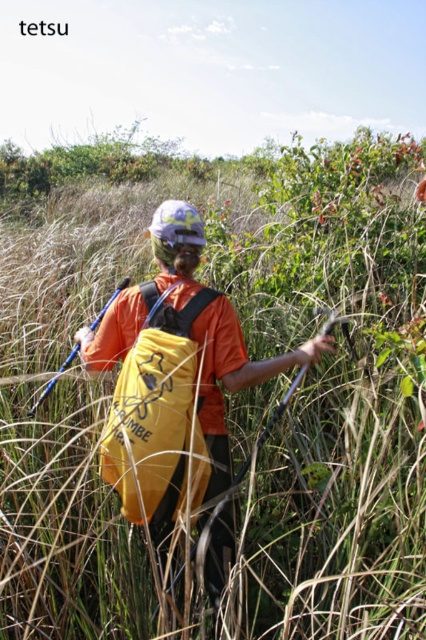
You are a hiker trying to locate your backpack in a dense marsh area. You remember placing it at a specific coordinate. Given that the backpack is at point (173, 381), can you confirm if this point is within the center area of the image?

Yes, the yellow matte backpack at center is located at point (173, 381), which matches the center area of the image.

You are a hiker who needs to choose between two backpacks to carry more gear. The yellow matte backpack at center and the yellow fabric backpack at center are both available. Which one should you pick based on their height?

The yellow matte backpack at center has a greater height compared to the yellow fabric backpack at center, so you should pick the yellow matte backpack at center to carry more gear.